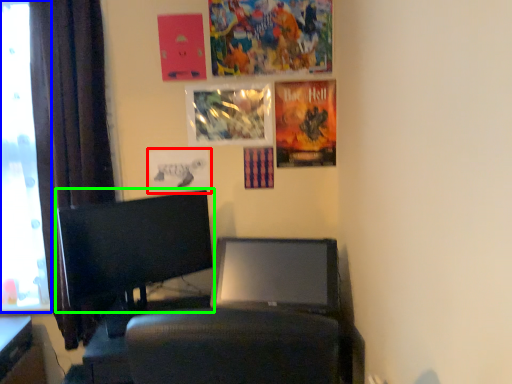
Question: Which object is positioned closest to poster page (highlighted by a red box)? Select from window screen (highlighted by a blue box) and computer monitor (highlighted by a green box).

Choices:
 (A) window screen
 (B) computer monitor

Answer: (B)